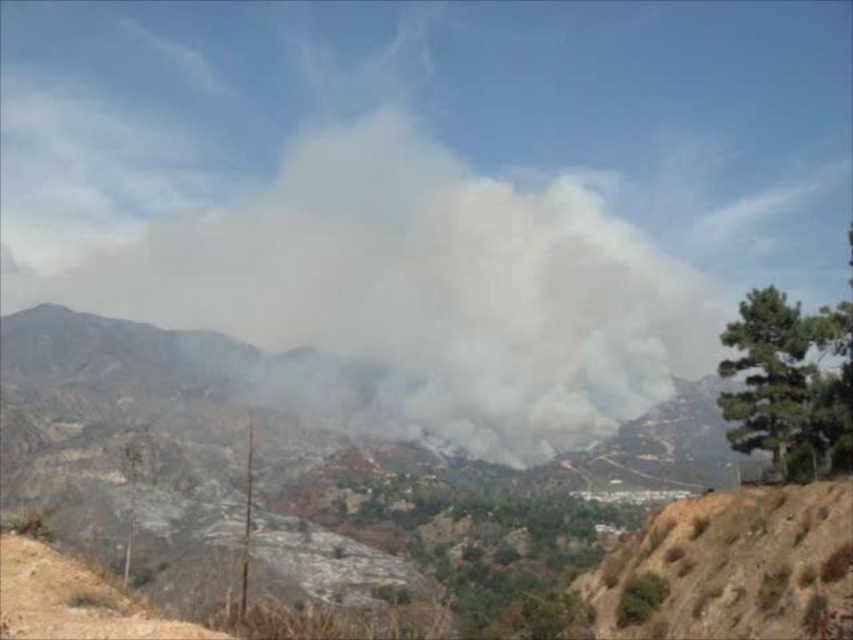
Question: Where is white smoke at center located in relation to brown dirt track at lower left in the image?

Choices:
 (A) right
 (B) left

Answer: (B)

Question: Considering the relative positions of white smoke at center and brown dirt track at lower left in the image provided, where is white smoke at center located with respect to brown dirt track at lower left?

Choices:
 (A) above
 (B) below

Answer: (A)

Question: Which point is farther to the camera?

Choices:
 (A) brown dirt track at lower left
 (B) white smoke at center

Answer: (B)

Question: Is white smoke at center behind brown dirt track at lower left?

Choices:
 (A) yes
 (B) no

Answer: (A)

Question: Which point is farther to the camera?

Choices:
 (A) (653, 380)
 (B) (59, 561)

Answer: (A)

Question: Which point is closer to the camera?

Choices:
 (A) (531, 413)
 (B) (39, 576)

Answer: (B)